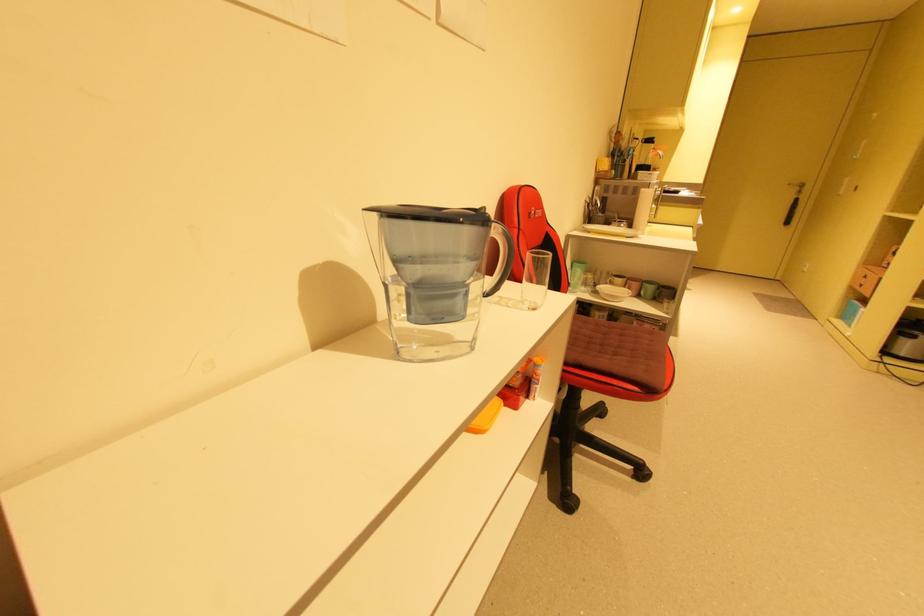
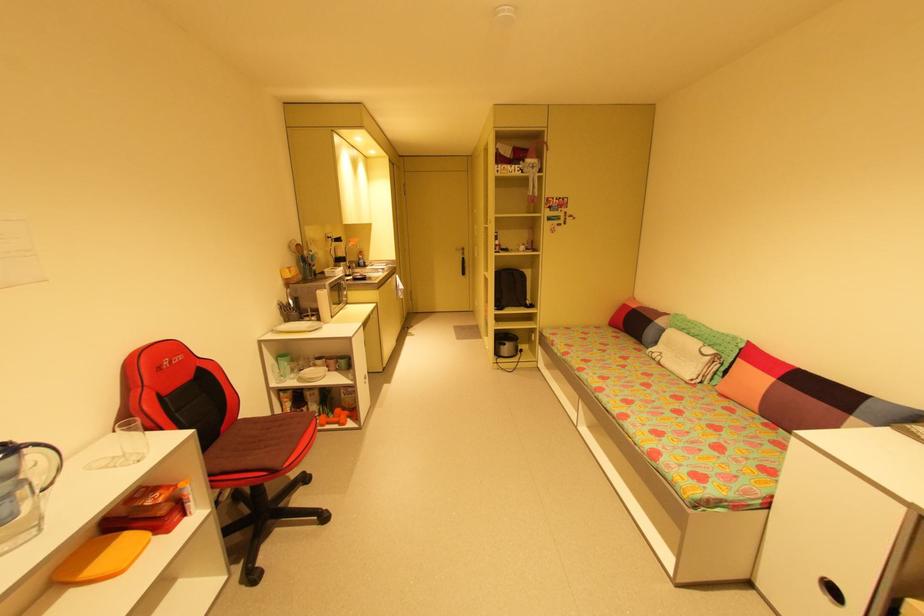
Locate, in the second image, the point that corresponds to (x=611, y=284) in the first image.

(313, 367)